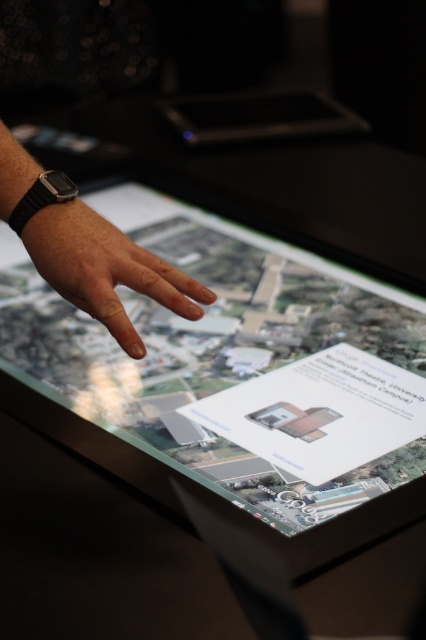
Question: Which object is closer to the camera taking this photo?

Choices:
 (A) transparent glass map at center
 (B) black glossy tablet at upper center

Answer: (A)

Question: Is transparent glass map at center further to camera compared to smooth skin hand at center?

Choices:
 (A) no
 (B) yes

Answer: (A)

Question: Which point is farther from the camera taking this photo?

Choices:
 (A) (207, 112)
 (B) (414, 316)
 (C) (123, 250)

Answer: (A)

Question: Which object is closer to the camera taking this photo?

Choices:
 (A) black glossy tablet at upper center
 (B) smooth skin hand at center
 (C) transparent glass map at center

Answer: (C)

Question: Does smooth skin hand at center appear on the right side of black glossy tablet at upper center?

Choices:
 (A) yes
 (B) no

Answer: (B)

Question: Is transparent glass map at center wider than smooth skin hand at center?

Choices:
 (A) yes
 (B) no

Answer: (A)